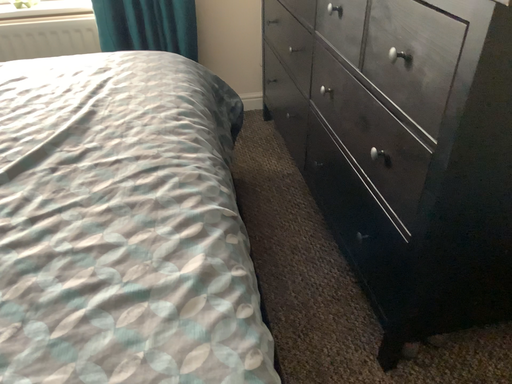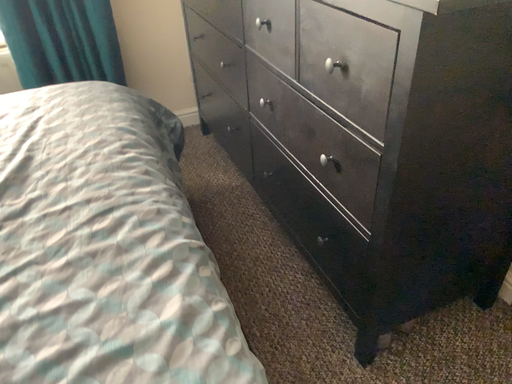
Question: Which way did the camera rotate in the video?

Choices:
 (A) rotated right
 (B) rotated left

Answer: (A)